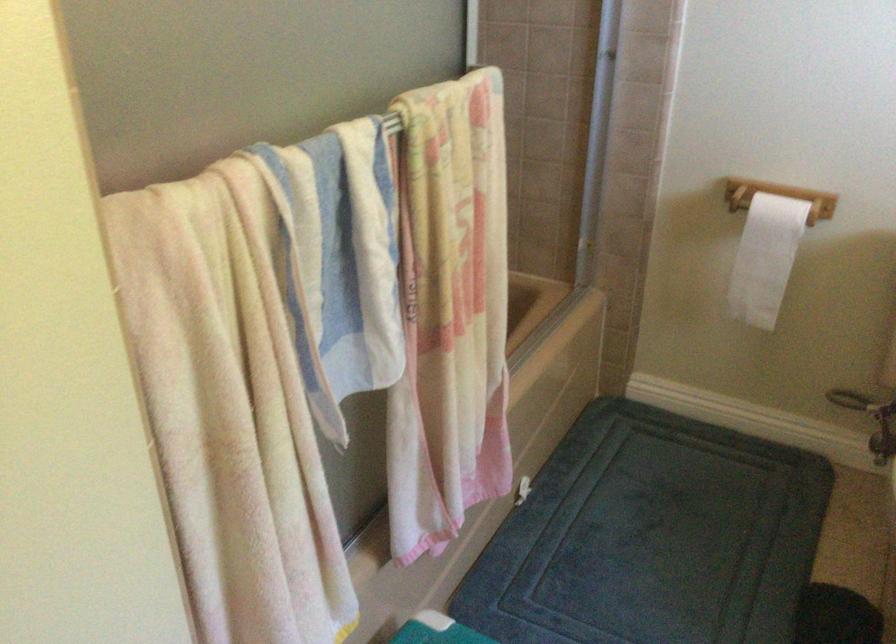
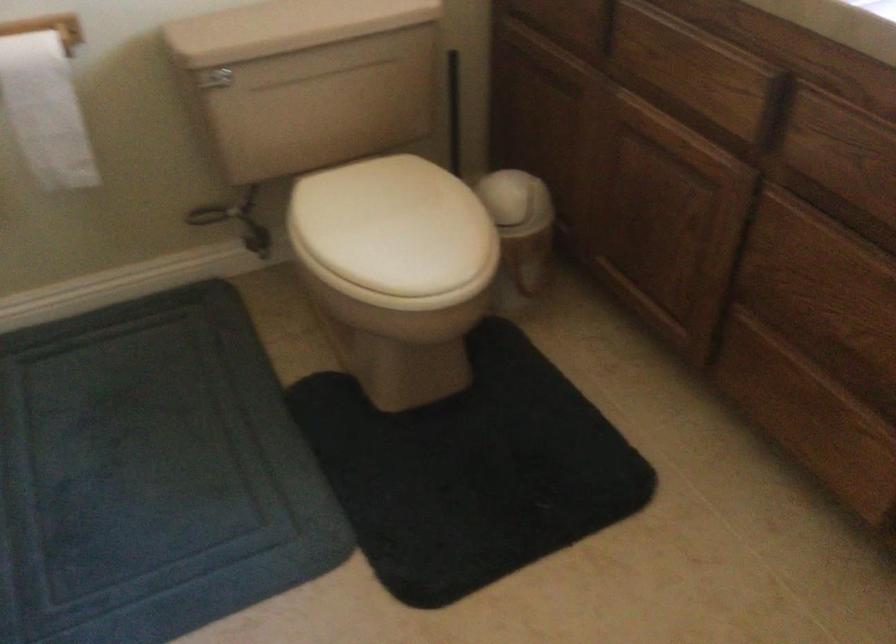
The images are taken continuously from a first-person perspective. In which direction is your viewpoint rotating?

The camera rotated toward right-down.